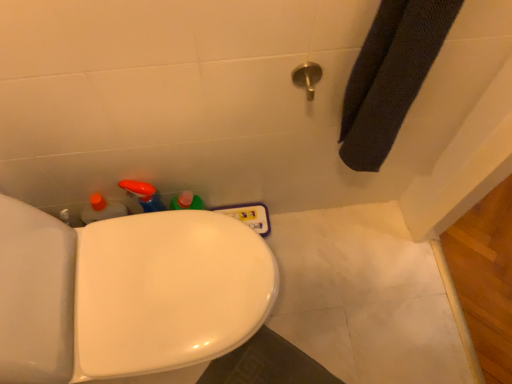
What do you see at coordinates (126, 293) in the screenshot?
I see `white glossy toilet at lower left` at bounding box center [126, 293].

Identify the location of white glossy toilet at lower left. (126, 293).

This screenshot has height=384, width=512. In order to click on metallic silver showerhead at upper center in this screenshot , I will do `click(307, 77)`.

What do you see at coordinates (307, 77) in the screenshot?
I see `metallic silver showerhead at upper center` at bounding box center [307, 77].

The height and width of the screenshot is (384, 512). Find the location of `white glossy toilet at lower left`. white glossy toilet at lower left is located at coordinates (126, 293).

Is metallic silver showerhead at upper center at the left side of white glossy toilet at lower left?

No.

Which is in front, metallic silver showerhead at upper center or white glossy toilet at lower left?

white glossy toilet at lower left is in front.

Is point (310, 83) farther from viewer compared to point (64, 237)?

No, it is in front of (64, 237).

In the scene shown: From the image's perspective, is metallic silver showerhead at upper center above or below white glossy toilet at lower left?

Clearly, from the image's perspective, metallic silver showerhead at upper center is above white glossy toilet at lower left.

From a real-world perspective, is metallic silver showerhead at upper center beneath white glossy toilet at lower left?

No, from a real-world perspective, metallic silver showerhead at upper center is not under white glossy toilet at lower left.

Considering the sizes of objects metallic silver showerhead at upper center and white glossy toilet at lower left in the image provided, who is thinner, metallic silver showerhead at upper center or white glossy toilet at lower left?

With smaller width is metallic silver showerhead at upper center.

From their relative heights in the image, would you say metallic silver showerhead at upper center is taller or shorter than white glossy toilet at lower left?

Clearly, metallic silver showerhead at upper center is shorter compared to white glossy toilet at lower left.

Which of these two, metallic silver showerhead at upper center or white glossy toilet at lower left, is bigger?

Bigger between the two is white glossy toilet at lower left.

Is white glossy toilet at lower left surrounded by metallic silver showerhead at upper center?

No.

Is metallic silver showerhead at upper center with white glossy toilet at lower left?

There is a gap between metallic silver showerhead at upper center and white glossy toilet at lower left.

Is metallic silver showerhead at upper center oriented away from white glossy toilet at lower left?

No.

How different are the orientations of metallic silver showerhead at upper center and white glossy toilet at lower left in degrees?

metallic silver showerhead at upper center and white glossy toilet at lower left are facing 90.1 degrees away from each other.

Identify the location of shower above the white glossy toilet at lower left (from a real-world perspective). The height and width of the screenshot is (384, 512). (307, 77).

Which object is positioned more to the right, white glossy toilet at lower left or metallic silver showerhead at upper center?

Positioned to the right is metallic silver showerhead at upper center.

In the image, is white glossy toilet at lower left positioned in front of or behind metallic silver showerhead at upper center?

white glossy toilet at lower left is positioned closer to the viewer than metallic silver showerhead at upper center.

Is point (238, 260) closer to viewer compared to point (300, 70)?

No, (238, 260) is further to viewer.

From the image's perspective, between white glossy toilet at lower left and metallic silver showerhead at upper center, who is located below?

white glossy toilet at lower left appears lower in the image.

From a real-world perspective, is white glossy toilet at lower left over metallic silver showerhead at upper center?

Actually, white glossy toilet at lower left is physically below metallic silver showerhead at upper center in the real world.

Considering the sizes of objects white glossy toilet at lower left and metallic silver showerhead at upper center in the image provided, who is thinner, white glossy toilet at lower left or metallic silver showerhead at upper center?

With smaller width is metallic silver showerhead at upper center.

Considering the sizes of objects white glossy toilet at lower left and metallic silver showerhead at upper center in the image provided, who is taller, white glossy toilet at lower left or metallic silver showerhead at upper center?

With more height is white glossy toilet at lower left.

Considering the sizes of objects white glossy toilet at lower left and metallic silver showerhead at upper center in the image provided, who is bigger, white glossy toilet at lower left or metallic silver showerhead at upper center?

With larger size is white glossy toilet at lower left.

Is white glossy toilet at lower left located outside metallic silver showerhead at upper center?

white glossy toilet at lower left lies outside metallic silver showerhead at upper center's area.

Are white glossy toilet at lower left and metallic silver showerhead at upper center located far from each other?

That's not correct — white glossy toilet at lower left is a little close to metallic silver showerhead at upper center.

Is white glossy toilet at lower left facing away from metallic silver showerhead at upper center?

white glossy toilet at lower left is not turned away from metallic silver showerhead at upper center.

How different are the orientations of white glossy toilet at lower left and metallic silver showerhead at upper center in degrees?

There is a 90.1-degree angle between the facing directions of white glossy toilet at lower left and metallic silver showerhead at upper center.

In the scene shown: How far apart are white glossy toilet at lower left and metallic silver showerhead at upper center?

A distance of 21.60 inches exists between white glossy toilet at lower left and metallic silver showerhead at upper center.

Identify the location of toilet in front of the metallic silver showerhead at upper center. The image size is (512, 384). (126, 293).

Locate an element on the screen. The width and height of the screenshot is (512, 384). shower on the right of white glossy toilet at lower left is located at coordinates (307, 77).

The image size is (512, 384). I want to click on toilet below the metallic silver showerhead at upper center (from the image's perspective), so click(126, 293).